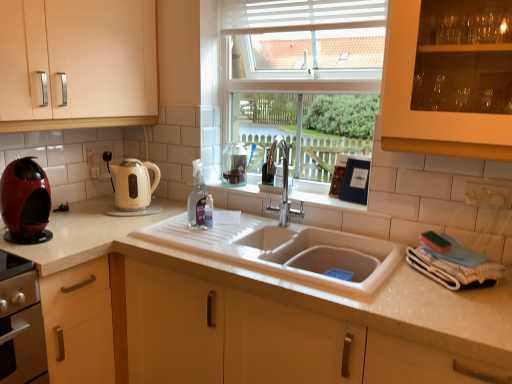
Question: In terms of height, does matte cream cabinet at left look taller or shorter compared to cream matte electric kettle at left, which is the 2th kitchen appliance in front-to-back order?

Choices:
 (A) short
 (B) tall

Answer: (B)

Question: Considering the positions of point (129, 29) and point (143, 175), is point (129, 29) closer or farther from the camera than point (143, 175)?

Choices:
 (A) farther
 (B) closer

Answer: (B)

Question: Based on their relative distances, which object is farther from the white glossy countertop at center?

Choices:
 (A) clear glass spray bottle at center
 (B) matte cream cabinet at left
 (C) white plastic blinds at upper center
 (D) shiny red coffee machine at left, which is the first kitchen appliance from front to back
 (E) cream matte electric kettle at left, the second kitchen appliance from the left

Answer: (C)

Question: Estimate the real-world distances between objects in this image. Which object is farther from the white glossy countertop at center?

Choices:
 (A) cream matte electric kettle at left, which is the 2th kitchen appliance in front-to-back order
 (B) clear glass spray bottle at center
 (C) white plastic blinds at upper center
 (D) matte cream cabinet at left
 (E) shiny red coffee machine at left, which appears as the first kitchen appliance when viewed from the left

Answer: (C)